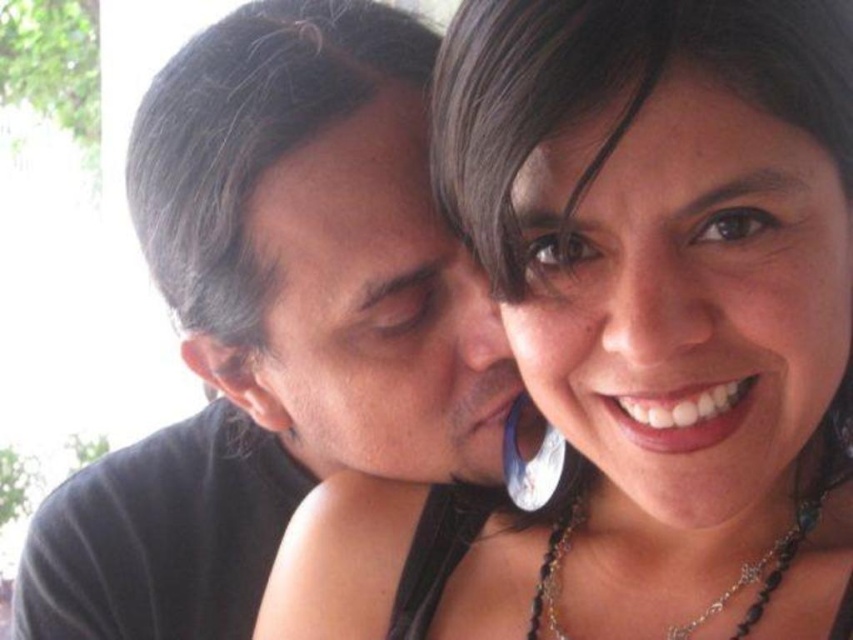
Based on the photo, you are a photographer adjusting the focus on your camera. You want to ensure both the matte black shirt at center and the black beaded necklace at lower right are in sharp focus. Given that your camera has a depth of field range of 12 inches, will both objects be in focus?

The matte black shirt at center is 12.20 inches away from the black beaded necklace at lower right. Since the distance between them exceeds the camera depth of field range of 12 inches, the objects may not both be in focus simultaneously.

You are standing in the scene and want to move from the point at coordinates point (572, 584) to the point at coordinates point (318, 397). Which direction should you move to reach your destination?

To move from point (572, 584) to point (318, 397), you should move diagonally towards the upper left direction since point (318, 397) is located above and to the left of point (572, 584).

You are a photographer adjusting the lighting for a portrait. You notice the matte black hair at center and the black beaded necklace at lower right in your frame. Which object should you focus on first if you want to highlight the one that is positioned to the left?

The matte black hair at center should be focused on first since it is positioned to the left of the black beaded necklace at lower right.